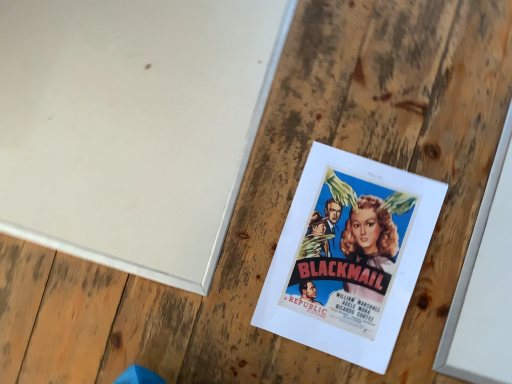
You are a GUI agent. You are given a task and a screenshot of the screen. Output one action in this format:
    pyautogui.click(x=<x>, y=<y>)
    Task: Click on the white matte bulletin board at upper left
    The height and width of the screenshot is (384, 512).
    Given the screenshot: What is the action you would take?
    pyautogui.click(x=132, y=126)

What do you see at coordinates (132, 126) in the screenshot? I see `white matte bulletin board at upper left` at bounding box center [132, 126].

Where is `matte paper poster at center`? The width and height of the screenshot is (512, 384). matte paper poster at center is located at coordinates (349, 256).

This screenshot has width=512, height=384. What do you see at coordinates (349, 256) in the screenshot?
I see `matte paper poster at center` at bounding box center [349, 256].

This screenshot has height=384, width=512. Find the location of `white matte bulletin board at upper left`. white matte bulletin board at upper left is located at coordinates (132, 126).

Visually, is matte paper poster at center positioned to the left or to the right of white matte bulletin board at upper left?

matte paper poster at center is positioned on white matte bulletin board at upper left's right side.

Does matte paper poster at center lie in front of white matte bulletin board at upper left?

Yes, matte paper poster at center is closer to the camera.

Between point (314, 158) and point (205, 74), which one is positioned in front?

Positioned in front is point (314, 158).

From the image's perspective, is matte paper poster at center on top of white matte bulletin board at upper left?

Incorrect, from the image's perspective, matte paper poster at center is lower than white matte bulletin board at upper left.

Consider the image. From a real-world perspective, is matte paper poster at center over white matte bulletin board at upper left?

Yes, from a real-world perspective, matte paper poster at center is above white matte bulletin board at upper left.

Based on the photo, considering the sizes of objects matte paper poster at center and white matte bulletin board at upper left in the image provided, who is wider, matte paper poster at center or white matte bulletin board at upper left?

white matte bulletin board at upper left is wider.

In terms of height, does matte paper poster at center look taller or shorter compared to white matte bulletin board at upper left?

Clearly, matte paper poster at center is taller compared to white matte bulletin board at upper left.

Between matte paper poster at center and white matte bulletin board at upper left, which one has smaller size?

Smaller between the two is matte paper poster at center.

Is matte paper poster at center inside the boundaries of white matte bulletin board at upper left, or outside?

matte paper poster at center cannot be found inside white matte bulletin board at upper left.

Is matte paper poster at center positioned far away from white matte bulletin board at upper left?

matte paper poster at center is actually quite close to white matte bulletin board at upper left.

Is matte paper poster at center oriented towards white matte bulletin board at upper left?

No.

Can you tell me how much matte paper poster at center and white matte bulletin board at upper left differ in facing direction?

They differ by 2.42 degrees in their facing directions.

Where is `poster in front of the white matte bulletin board at upper left`? poster in front of the white matte bulletin board at upper left is located at coordinates (349, 256).

Considering the relative positions of white matte bulletin board at upper left and matte paper poster at center in the image provided, is white matte bulletin board at upper left to the right of matte paper poster at center from the viewer's perspective?

Incorrect, white matte bulletin board at upper left is not on the right side of matte paper poster at center.

Considering their positions, is white matte bulletin board at upper left located in front of or behind matte paper poster at center?

Clearly, white matte bulletin board at upper left is behind matte paper poster at center.

Does point (112, 235) come behind point (369, 225)?

Yes, point (112, 235) is farther from viewer.

From the image's perspective, would you say white matte bulletin board at upper left is shown under matte paper poster at center?

Actually, white matte bulletin board at upper left appears above matte paper poster at center in the image.

From a real-world perspective, who is located lower, white matte bulletin board at upper left or matte paper poster at center?

white matte bulletin board at upper left, from a real-world perspective.

Can you confirm if white matte bulletin board at upper left is thinner than matte paper poster at center?

No.

Who is taller, white matte bulletin board at upper left or matte paper poster at center?

matte paper poster at center.

Based on the photo, can you confirm if white matte bulletin board at upper left is bigger than matte paper poster at center?

Yes.

Is white matte bulletin board at upper left situated inside matte paper poster at center or outside?

white matte bulletin board at upper left is spatially situated outside matte paper poster at center.

Looking at this image, are white matte bulletin board at upper left and matte paper poster at center far apart?

That's not correct — white matte bulletin board at upper left is a little close to matte paper poster at center.

Is white matte bulletin board at upper left looking in the opposite direction of matte paper poster at center?

white matte bulletin board at upper left does not have its back to matte paper poster at center.

Can you tell me how much white matte bulletin board at upper left and matte paper poster at center differ in facing direction?

white matte bulletin board at upper left and matte paper poster at center are facing 2.42 degrees away from each other.

How far apart are white matte bulletin board at upper left and matte paper poster at center?

white matte bulletin board at upper left is 9.87 inches from matte paper poster at center.

Find the location of `bulletin board directly beneath the matte paper poster at center (from a real-world perspective)`. bulletin board directly beneath the matte paper poster at center (from a real-world perspective) is located at coordinates (132, 126).

At what (x,y) coordinates should I click in order to perform the action: click on poster above the white matte bulletin board at upper left (from a real-world perspective). Please return your answer as a coordinate pair (x, y). This screenshot has height=384, width=512. Looking at the image, I should click on (349, 256).

What are the coordinates of `bulletin board below the matte paper poster at center (from a real-world perspective)` in the screenshot? It's located at (132, 126).